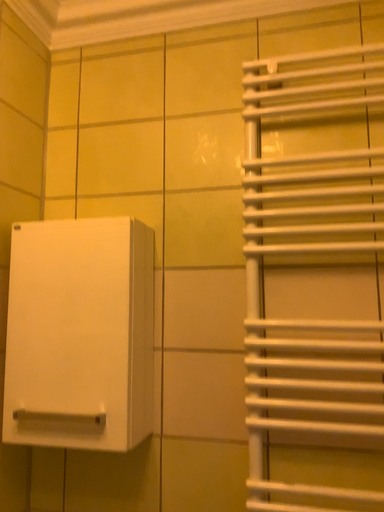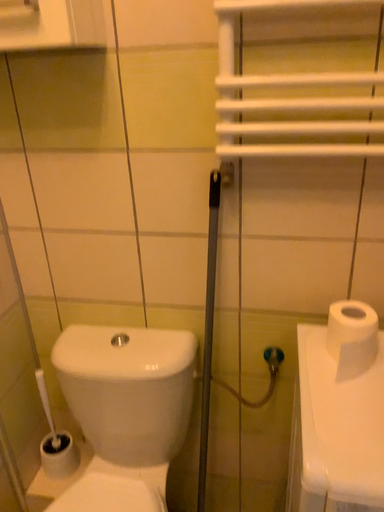
Question: Which way did the camera rotate in the video?

Choices:
 (A) rotated upward
 (B) rotated downward

Answer: (B)